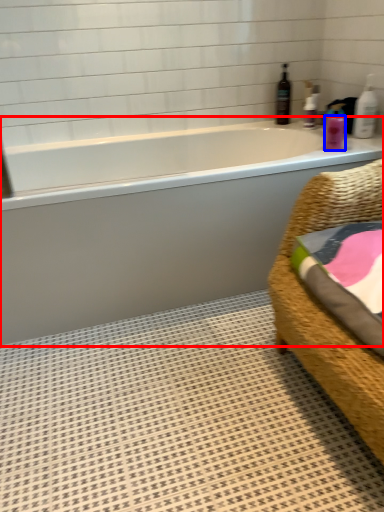
Question: Which of the following is the closest to the observer, bathtub (highlighted by a red box) or toiletry (highlighted by a blue box)?

Choices:
 (A) bathtub
 (B) toiletry

Answer: (A)